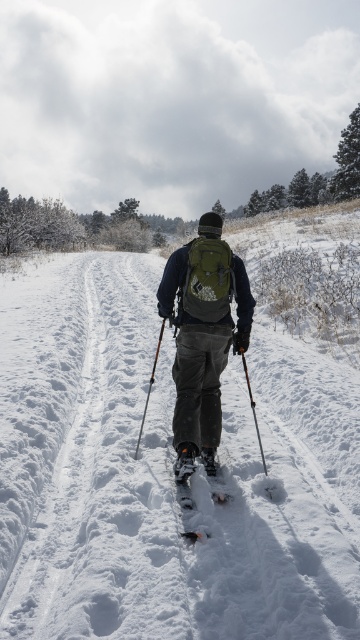
Does white textured snowshoe at center have a lesser height compared to white rubber snowshoe at center?

Incorrect, white textured snowshoe at center's height does not fall short of white rubber snowshoe at center's.

The image size is (360, 640). Describe the element at coordinates (185, 461) in the screenshot. I see `white textured snowshoe at center` at that location.

At what (x,y) coordinates should I click in order to perform the action: click on white textured snowshoe at center. Please return your answer as a coordinate pair (x, y). Image resolution: width=360 pixels, height=640 pixels. Looking at the image, I should click on (185, 461).

Is point (261, 442) less distant than point (213, 454)?

No, it is behind (213, 454).

This screenshot has width=360, height=640. Identify the location of black plastic ski pole at center. (253, 410).

Between point (249, 392) and point (209, 465), which one is positioned behind?

Positioned behind is point (249, 392).

Image resolution: width=360 pixels, height=640 pixels. Identify the location of black plastic ski pole at center. (253, 410).

Describe the element at coordinates (191, 490) in the screenshot. I see `black matte ski at center` at that location.

Is black matte ski at center smaller than black plastic ski pole at center?

Indeed, black matte ski at center has a smaller size compared to black plastic ski pole at center.

Between point (196, 534) and point (259, 445), which one is positioned in front?

Point (196, 534) is in front.

Image resolution: width=360 pixels, height=640 pixels. I want to click on black matte ski at center, so click(191, 490).